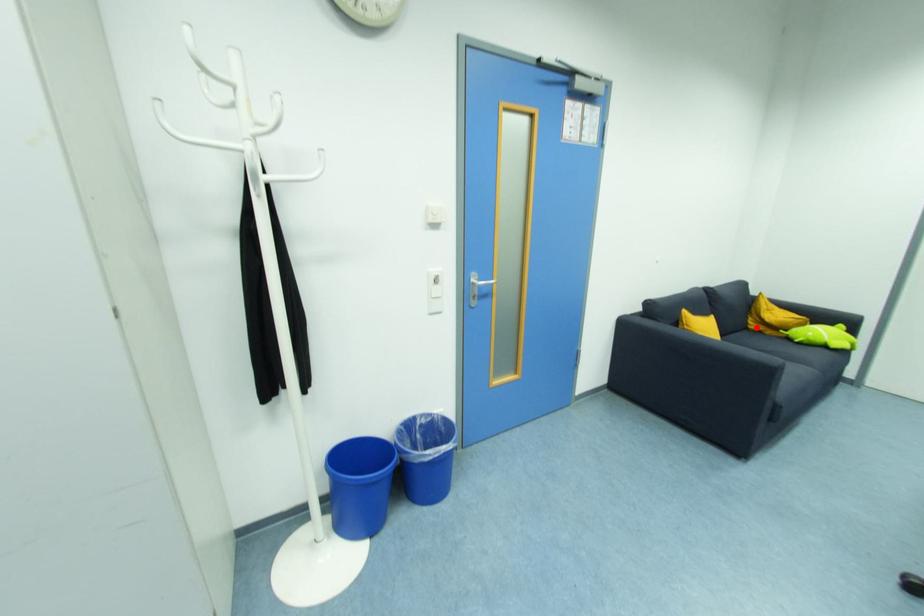
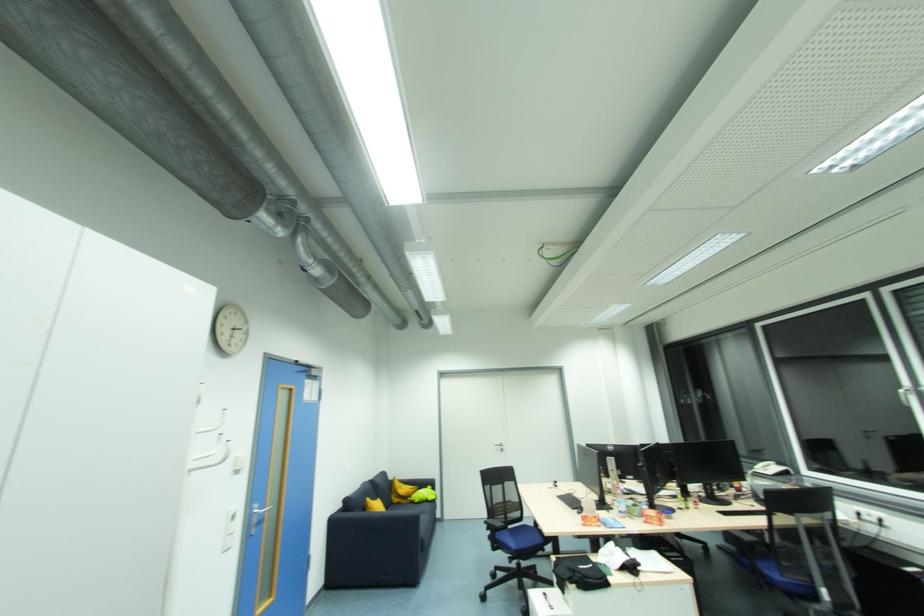
In the second image, find the point that corresponds to the highlighted location in the first image.

(397, 501)